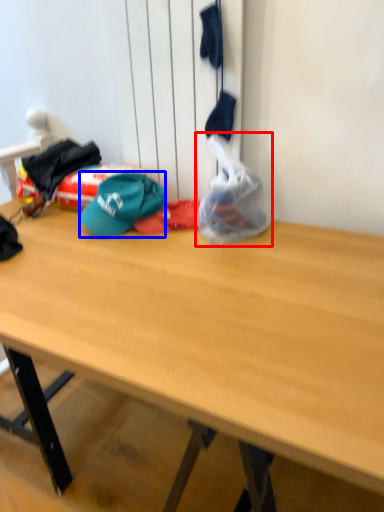
Question: Which object appears farthest to the camera in this image, plastic bag (highlighted by a red box) or hat (highlighted by a blue box)?

Choices:
 (A) plastic bag
 (B) hat

Answer: (B)